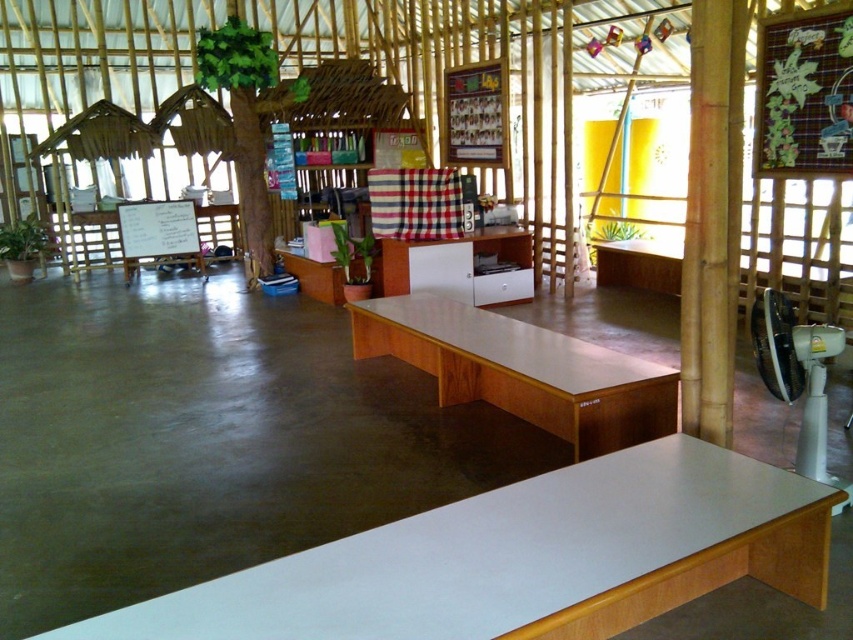
Question: Estimate the real-world distances between objects in this image. Which object is farther from the white glossy table at lower center?

Choices:
 (A) light brown wood table at center
 (B) white glossy cabinet at center

Answer: (B)

Question: Among these points, which one is nearest to the camera?

Choices:
 (A) (490, 634)
 (B) (363, 323)
 (C) (500, 236)

Answer: (A)

Question: Considering the relative positions of white glossy table at lower center and light brown wood table at center in the image provided, where is white glossy table at lower center located with respect to light brown wood table at center?

Choices:
 (A) below
 (B) above

Answer: (A)

Question: Does white glossy table at lower center appear under white glossy cabinet at center?

Choices:
 (A) yes
 (B) no

Answer: (A)

Question: Does white glossy table at lower center have a greater width compared to white glossy cabinet at center?

Choices:
 (A) no
 (B) yes

Answer: (B)

Question: Which of the following is the farthest from the observer?

Choices:
 (A) (457, 294)
 (B) (383, 632)
 (C) (567, 424)

Answer: (A)